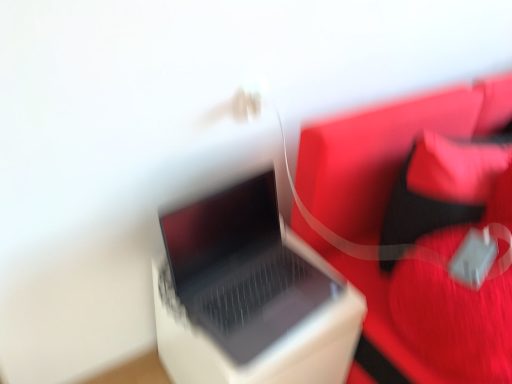
Question: Is rubberized red bag at right to the left or to the right of white plastic laptop at center in the image?

Choices:
 (A) left
 (B) right

Answer: (B)

Question: From the image's perspective, is rubberized red bag at right above or below white plastic laptop at center?

Choices:
 (A) above
 (B) below

Answer: (A)

Question: Which is farther from the satin black laptop at center?

Choices:
 (A) white plastic laptop at center
 (B) rubberized red bag at right
 (C) velvet red bean bag chair at right

Answer: (C)

Question: Considering the real-world distances, which object is farthest from the rubberized red bag at right?

Choices:
 (A) satin black laptop at center
 (B) white plastic laptop at center
 (C) velvet red bean bag chair at right

Answer: (B)